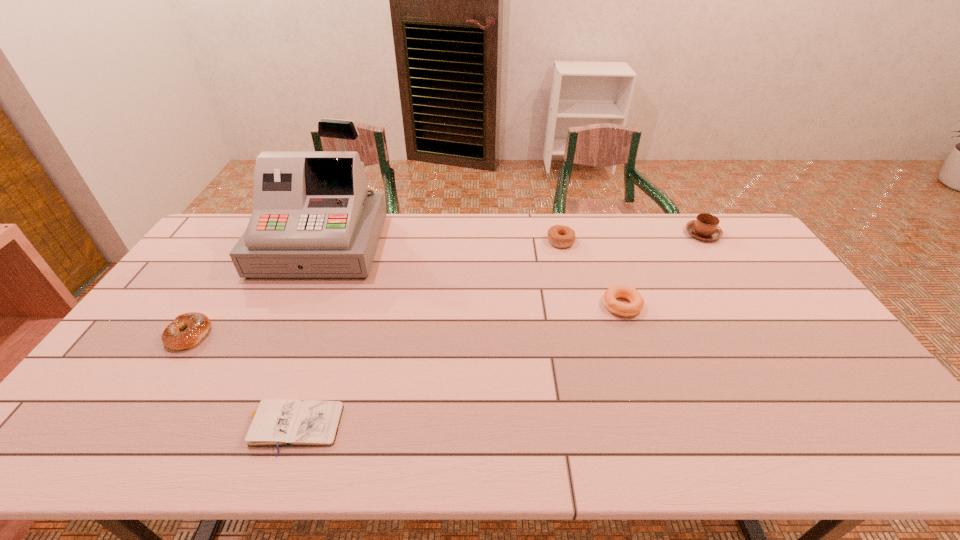
The image size is (960, 540). I want to click on free space between the leftmost bagel and the second bagel from left to right, so click(x=375, y=288).

The width and height of the screenshot is (960, 540). Identify the location of free space between the tallest object and the fourth object from left to right. (441, 243).

Where is `free spot between the rightmost object and the leftmost bagel`? Image resolution: width=960 pixels, height=540 pixels. free spot between the rightmost object and the leftmost bagel is located at coordinates (446, 284).

Where is `free space between the rightmost bagel and the cappuccino`? free space between the rightmost bagel and the cappuccino is located at coordinates (662, 269).

Where is `vacant space in between the cash register and the notebook`? The width and height of the screenshot is (960, 540). vacant space in between the cash register and the notebook is located at coordinates (306, 335).

Where is `vacant space in between the farthest bagel and the leftmost bagel`? The height and width of the screenshot is (540, 960). vacant space in between the farthest bagel and the leftmost bagel is located at coordinates (375, 288).

Where is `free space between the tallest object and the second bagel from right to left`? free space between the tallest object and the second bagel from right to left is located at coordinates (441, 243).

Locate an element on the screen. Image resolution: width=960 pixels, height=540 pixels. object that is the third closest to the second object from right to left is located at coordinates (313, 217).

Where is `object that is the closest to the leftmost bagel`? The height and width of the screenshot is (540, 960). object that is the closest to the leftmost bagel is located at coordinates (313, 217).

Point out which bagel is positioned as the second nearest to the cash register. Please provide its 2D coordinates. Your answer should be formatted as a tuple, i.e. [(x, y)], where the tuple contains the x and y coordinates of a point satisfying the conditions above.

[(559, 236)]